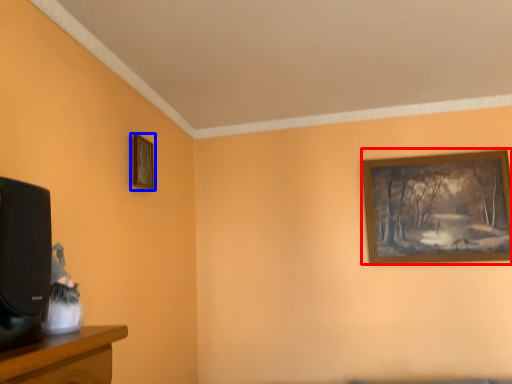
Question: Which point is further to the camera, picture frame (highlighted by a red box) or picture frame (highlighted by a blue box)?

Choices:
 (A) picture frame
 (B) picture frame

Answer: (A)